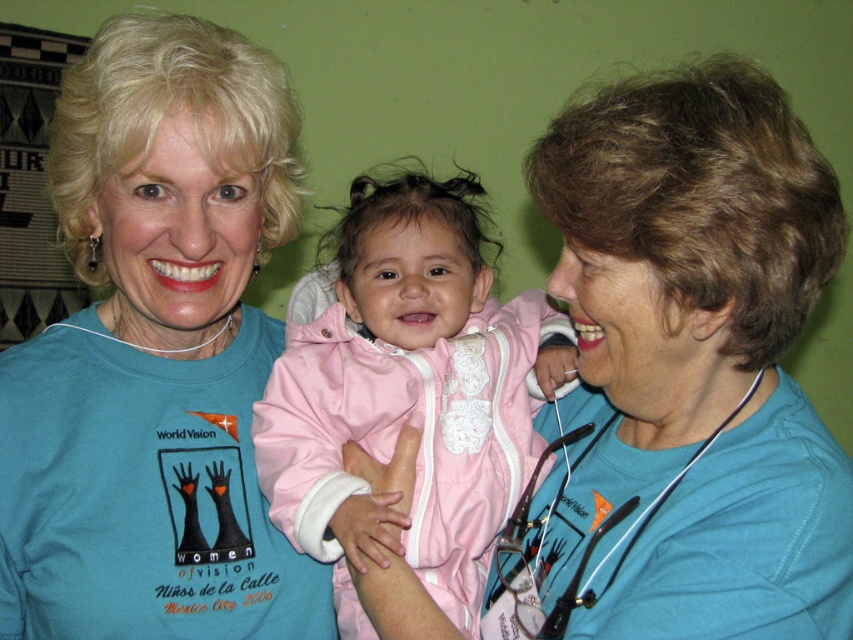
Does matte blue shirt at center appear under white plastic stethoscope at lower right?

Actually, matte blue shirt at center is above white plastic stethoscope at lower right.

Between matte blue shirt at center and white plastic stethoscope at lower right, which one is positioned higher?

matte blue shirt at center is higher up.

Identify the location of matte blue shirt at center. (155, 353).

At what (x,y) coordinates should I click in order to perform the action: click on matte blue shirt at center. Please return your answer as a coordinate pair (x, y). Image resolution: width=853 pixels, height=640 pixels. Looking at the image, I should click on (155, 353).

Which is below, matte blue shirt at center or pink satin jacket at center?

Positioned lower is pink satin jacket at center.

Is point (224, 172) closer to viewer compared to point (495, 428)?

Yes.

Identify the location of matte blue shirt at center. This screenshot has height=640, width=853. (155, 353).

Is pink satin jacket at center positioned before white plastic stethoscope at lower right?

No.

Which is behind, point (287, 536) or point (659, 500)?

The point (287, 536) is more distant.

Image resolution: width=853 pixels, height=640 pixels. I want to click on pink satin jacket at center, so click(404, 396).